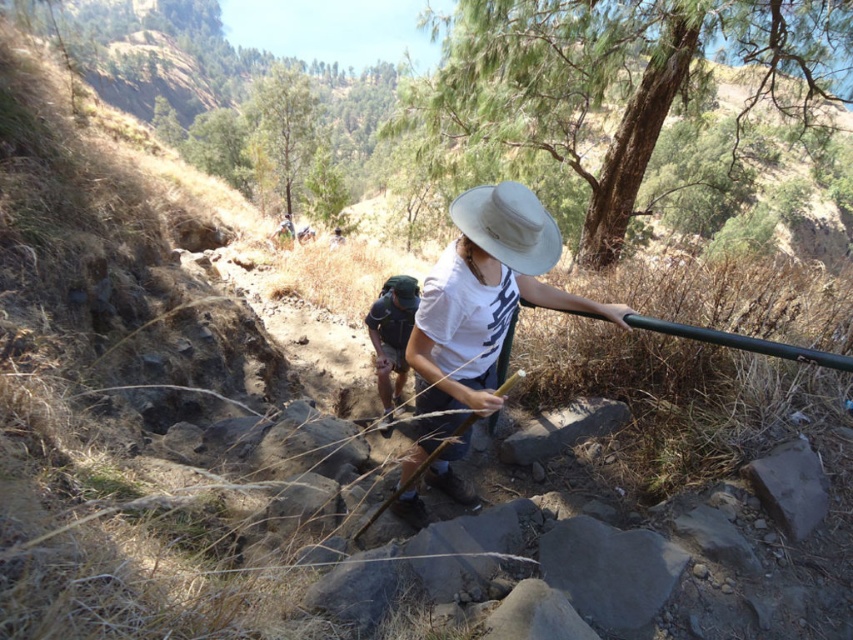
Does point (553, 246) come in front of point (415, 296)?

Yes.

I want to click on beige fabric hat at center, so click(508, 225).

Does white matte hat at center come in front of beige fabric hat at center?

Yes.

Is point (485, 342) closer to viewer compared to point (553, 257)?

No, (485, 342) is behind (553, 257).

Identify the location of white matte hat at center. Image resolution: width=853 pixels, height=640 pixels. (485, 296).

Which is above, white matte hat at center or camouflage backpack at center?

white matte hat at center is higher up.

Is white matte hat at center to the right of camouflage backpack at center from the viewer's perspective?

Yes, white matte hat at center is to the right of camouflage backpack at center.

The width and height of the screenshot is (853, 640). I want to click on white matte hat at center, so click(x=485, y=296).